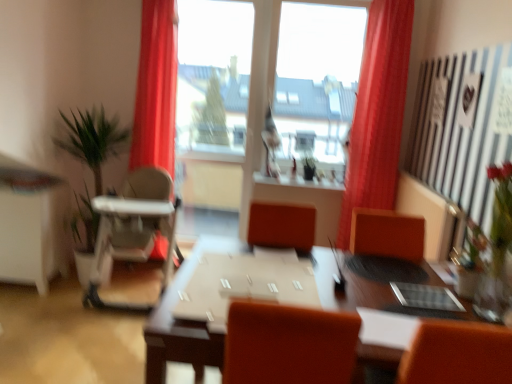
Question: From a real-world perspective, is clear glass vase at right on transparent glass window at center?

Choices:
 (A) yes
 (B) no

Answer: (B)

Question: Is clear glass vase at right far away from transparent glass window at center?

Choices:
 (A) no
 (B) yes

Answer: (B)

Question: Does clear glass vase at right have a greater height compared to transparent glass window at center?

Choices:
 (A) yes
 (B) no

Answer: (B)

Question: From the image's perspective, is clear glass vase at right on top of transparent glass window at center?

Choices:
 (A) no
 (B) yes

Answer: (A)

Question: From the image's perspective, is clear glass vase at right below transparent glass window at center?

Choices:
 (A) yes
 (B) no

Answer: (A)

Question: Is clear glass vase at right turned away from transparent glass window at center?

Choices:
 (A) no
 (B) yes

Answer: (A)

Question: Could you tell me if transparent glass window at center is turned towards white glossy computer desk at left?

Choices:
 (A) yes
 (B) no

Answer: (B)

Question: Is the surface of transparent glass window at center in direct contact with white glossy computer desk at left?

Choices:
 (A) yes
 (B) no

Answer: (B)

Question: From a real-world perspective, is transparent glass window at center over white glossy computer desk at left?

Choices:
 (A) yes
 (B) no

Answer: (A)

Question: Is white glossy computer desk at left at the back of transparent glass window at center?

Choices:
 (A) no
 (B) yes

Answer: (A)

Question: Is transparent glass window at center not within white glossy computer desk at left?

Choices:
 (A) no
 (B) yes

Answer: (B)

Question: Can you confirm if transparent glass window at center is smaller than white glossy computer desk at left?

Choices:
 (A) no
 (B) yes

Answer: (A)

Question: Is brown wooden table at center at the left side of transparent glass window at center?

Choices:
 (A) yes
 (B) no

Answer: (A)